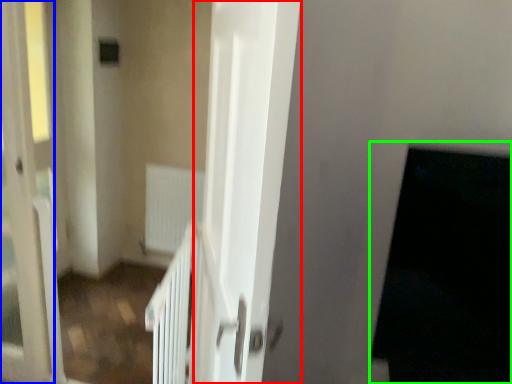
Question: Estimate the real-world distances between objects in this image. Which object is farther from screen door (highlighted by a red box), screen door (highlighted by a blue box) or dark (highlighted by a green box)?

Choices:
 (A) screen door
 (B) dark

Answer: (A)